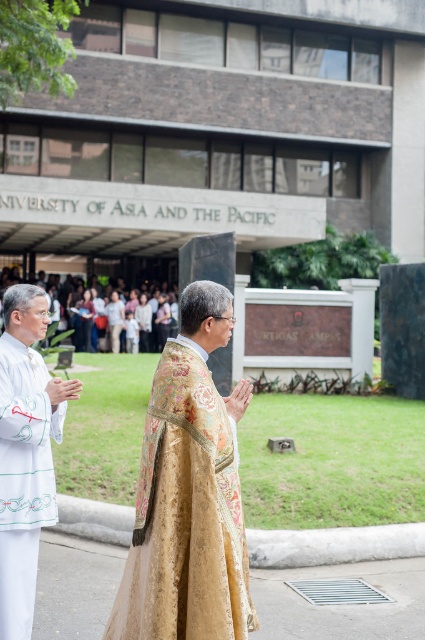
You are a photographer positioned at the entrance of the University of Asia and the Pacific. You want to capture a photo of both the gold brocade robe at center and the white silk robe at left. Based on their positions, which robe should you focus on first to ensure both are in frame?

The gold brocade robe at center is in front of the white silk robe at left, so you should focus on the gold brocade robe at center first to ensure both are in frame as the white silk robe at left is behind it.

You are standing at point (146, 634) and want to walk to the entrance of the University of Asia and the Pacific. The entrance is 11.97 feet away. If your walking speed is 3 feet per second, how many seconds will it take you to reach the entrance?

It will take approximately 4 seconds to reach the entrance since 11.97 divided by 3 is approximately 4.

You are a photographer standing 2 meters away from the entrance of the University of Asia and the Pacific. You want to take a photo of the gold brocade robe at center and the white silk robe at left so that both are fully visible in the frame. Given that your camera has a maximum field of view of 60 degrees, can you capture both robes in a single shot without moving closer or further away?

The gold brocade robe at center and white silk robe at left are 93.07 centimeters apart. At a distance of 2 meters, the angular width between them would be approximately 27 degrees, which is within the camera field of view of 60 degrees. Therefore, yes, you can capture both robes in a single shot.